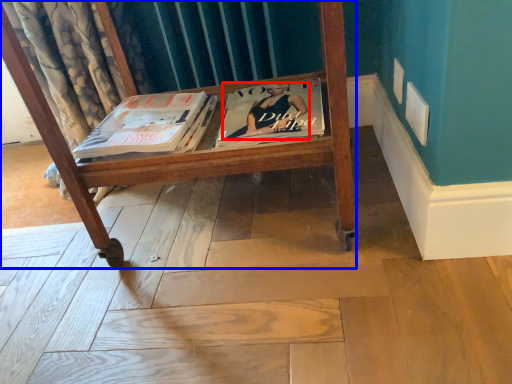
Question: Which of the following is the closest to the observer, person (highlighted by a red box) or furniture (highlighted by a blue box)?

Choices:
 (A) person
 (B) furniture

Answer: (B)